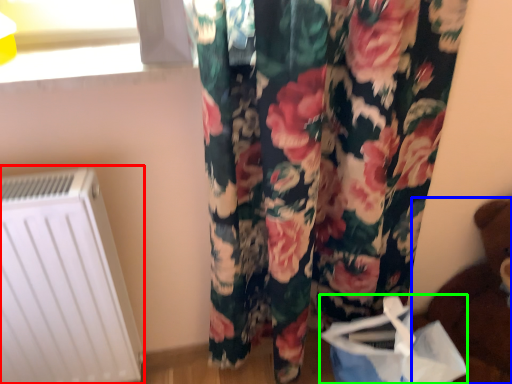
Question: Based on their relative distances, which object is nearer to radiator (highlighted by a red box)? Choose from toy (highlighted by a blue box) and shopping bag (highlighted by a green box).

Choices:
 (A) toy
 (B) shopping bag

Answer: (B)